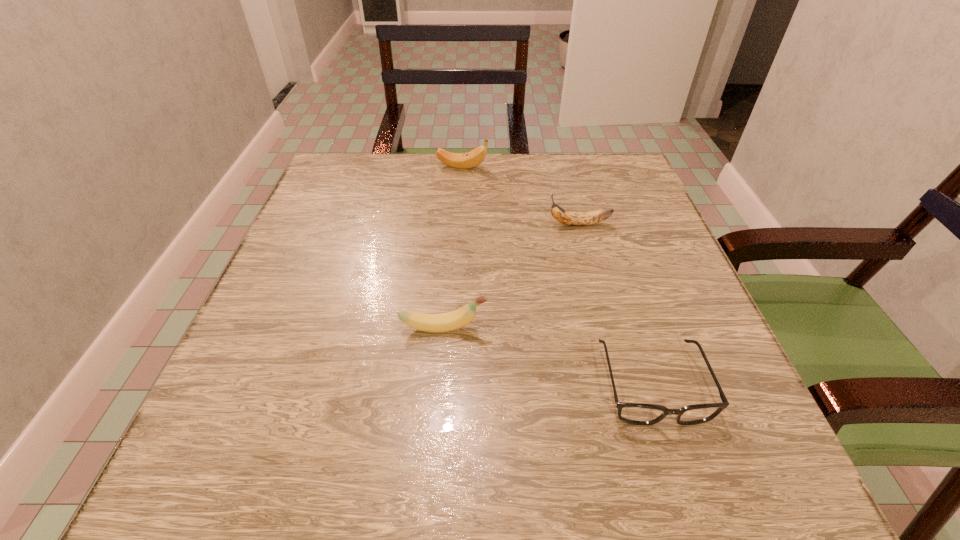
Locate an element on the screen. blank region between the shortest object and the nearest banana is located at coordinates click(x=548, y=356).

The width and height of the screenshot is (960, 540). What are the coordinates of `object that is the closest to the second farthest banana` in the screenshot? It's located at (473, 158).

Identify which object is located as the nearest to the spectacles. Please provide its 2D coordinates. Your answer should be formatted as a tuple, i.e. [(x, y)], where the tuple contains the x and y coordinates of a point satisfying the conditions above.

[(443, 322)]

Select which banana is the third closest to the nearest object. Please provide its 2D coordinates. Your answer should be formatted as a tuple, i.e. [(x, y)], where the tuple contains the x and y coordinates of a point satisfying the conditions above.

[(473, 158)]

Locate which banana ranks in proximity to the second farthest banana. Please provide its 2D coordinates. Your answer should be formatted as a tuple, i.e. [(x, y)], where the tuple contains the x and y coordinates of a point satisfying the conditions above.

[(473, 158)]